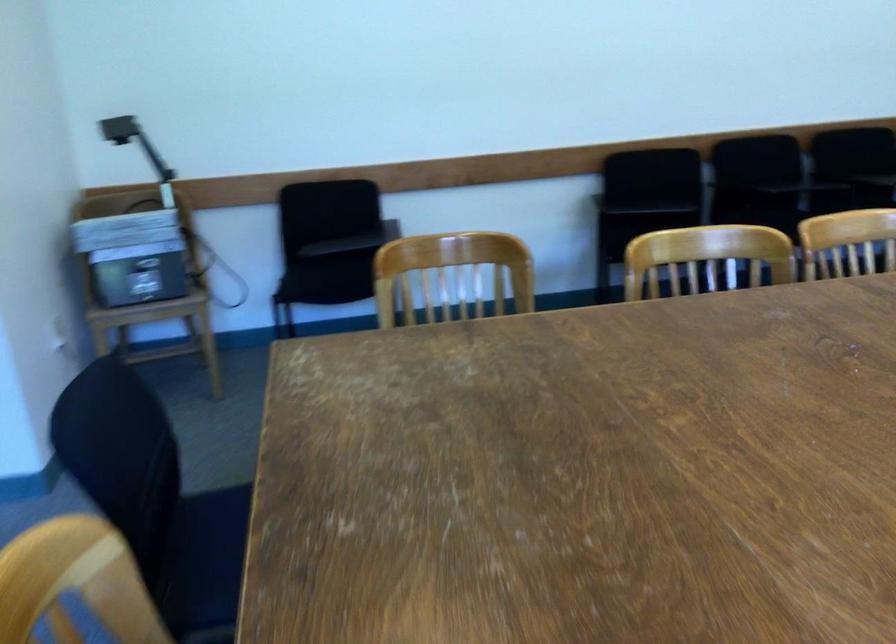
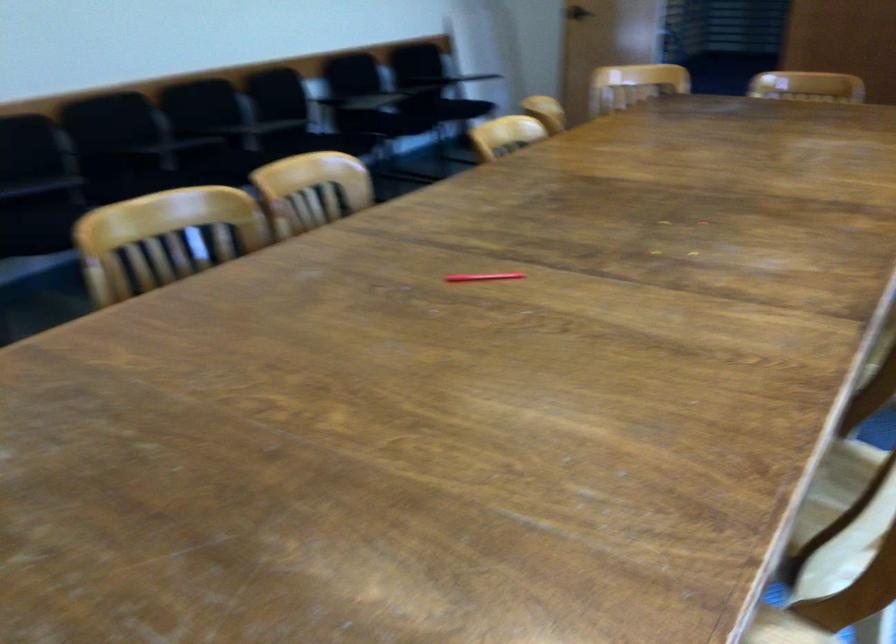
Question: How did the camera likely rotate?

Choices:
 (A) Left
 (B) Right
 (C) Up
 (D) Down

Answer: (B)